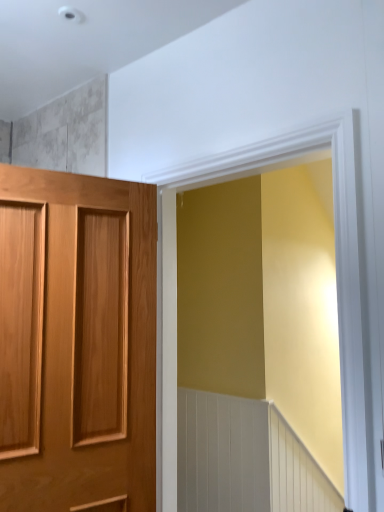
The height and width of the screenshot is (512, 384). Identify the location of light brown wood door at left. (77, 342).

Image resolution: width=384 pixels, height=512 pixels. What do you see at coordinates (77, 342) in the screenshot?
I see `light brown wood door at left` at bounding box center [77, 342].

This screenshot has height=512, width=384. Find the location of `light brown wood door at left`. light brown wood door at left is located at coordinates (77, 342).